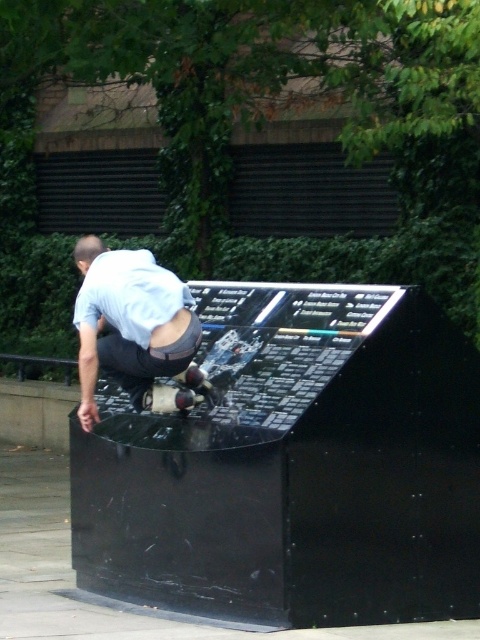
Does light blue shirt at center appear on the left side of shiny metallic skateboard at center?

Indeed, light blue shirt at center is positioned on the left side of shiny metallic skateboard at center.

The image size is (480, 640). In order to click on light blue shirt at center in this screenshot , I will do `click(130, 321)`.

Does point (82, 364) come in front of point (148, 404)?

That is True.

This screenshot has width=480, height=640. I want to click on light blue shirt at center, so click(x=130, y=321).